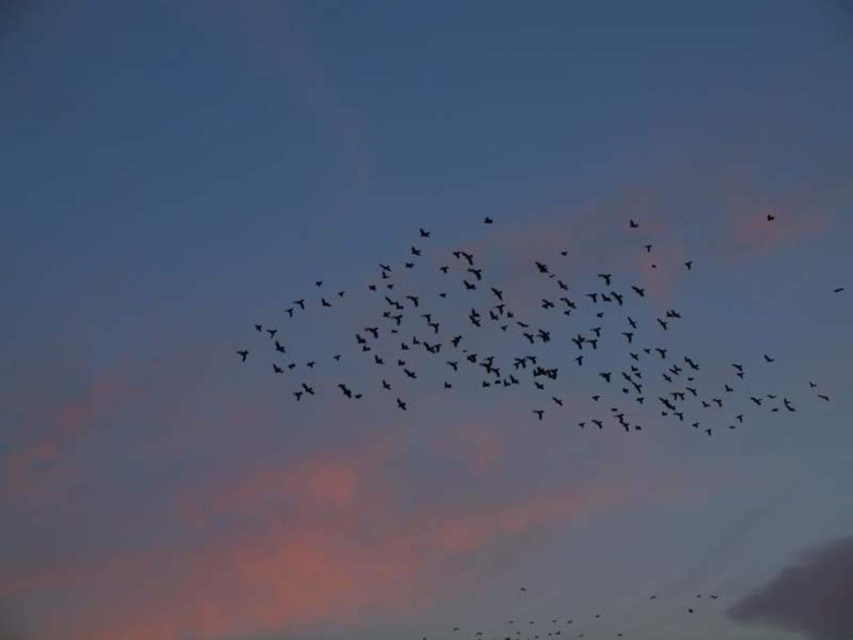
Question: Does black matte birds at center appear on the left side of black matte bird at upper right?

Choices:
 (A) yes
 (B) no

Answer: (A)

Question: Which object is closer to the camera taking this photo?

Choices:
 (A) black matte bird at upper right
 (B) gray matte cloud at lower right
 (C) black matte birds at center

Answer: (C)

Question: Based on their relative distances, which object is farther from the black matte bird at upper right?

Choices:
 (A) gray matte cloud at lower right
 (B) black matte birds at center

Answer: (A)

Question: Does black matte birds at center have a lesser width compared to gray matte cloud at lower right?

Choices:
 (A) no
 (B) yes

Answer: (A)

Question: Which point is closer to the camera?

Choices:
 (A) black matte bird at upper right
 (B) black matte birds at center
 (C) gray matte cloud at lower right

Answer: (B)

Question: Is black matte birds at center to the right of gray matte cloud at lower right from the viewer's perspective?

Choices:
 (A) yes
 (B) no

Answer: (B)